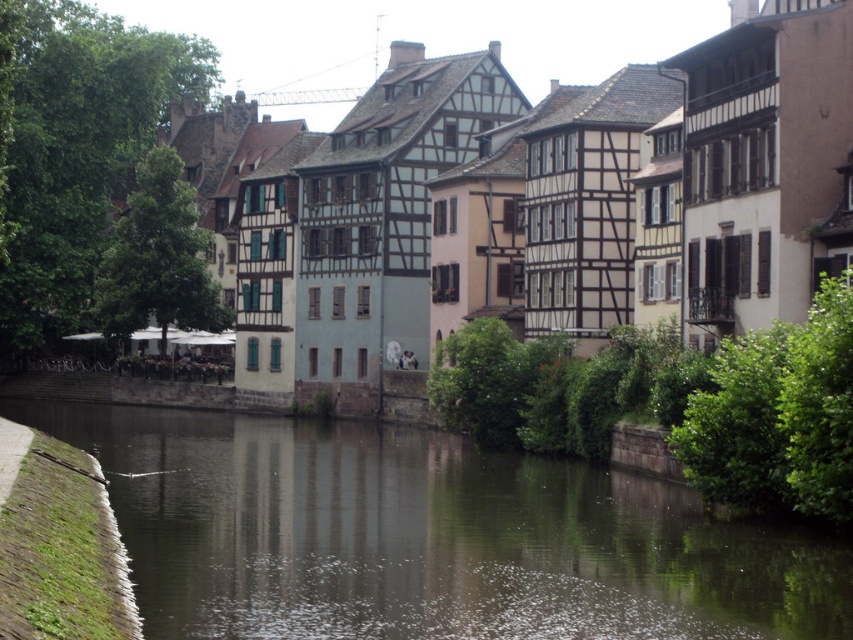
You are standing on the walkway next to the canal and see two points marked on the ground. The first point is at coordinate point (114,460) and the second is at point (96,550). Which point is closer to you?

Point (114,460) is closer to you because it is further to the viewer than point (96,550).

You are a tour guide leading a group along the canal walkway. You want to point out the dark brown water at center and the green mossy stone at lower left to your group. How far apart are these two landmarks?

The distance between the dark brown water at center and the green mossy stone at lower left is 10.86 meters.